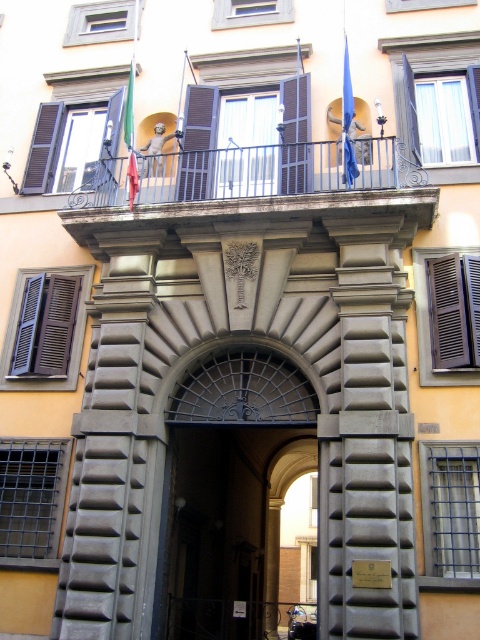
Does brown wooden shutter at right lie in front of brown wooden shutter at left?

Yes, brown wooden shutter at right is closer to the viewer.

Does point (447, 298) lie in front of point (36, 189)?

Yes, it is.

The image size is (480, 640). I want to click on brown wooden shutter at right, so click(455, 310).

Is brown wooden shutters at upper center to the left of green fabric flag at upper center from the viewer's perspective?

In fact, brown wooden shutters at upper center is to the right of green fabric flag at upper center.

Does brown wooden shutters at upper center appear on the right side of green fabric flag at upper center?

Correct, you'll find brown wooden shutters at upper center to the right of green fabric flag at upper center.

Measure the distance between point (283, 83) and camera.

A distance of 50.83 feet exists between point (283, 83) and camera.

Image resolution: width=480 pixels, height=640 pixels. What are the coordinates of `brown wooden shutters at upper center` in the screenshot? It's located at (295, 134).

In the scene shown: How much distance is there between dark gray stone archway at center and blue fabric flag at upper center?

They are 34.88 feet apart.

Who is higher up, dark gray stone archway at center or blue fabric flag at upper center?

blue fabric flag at upper center is above.

Where is `dark gray stone archway at center`? This screenshot has height=640, width=480. dark gray stone archway at center is located at coordinates (223, 529).